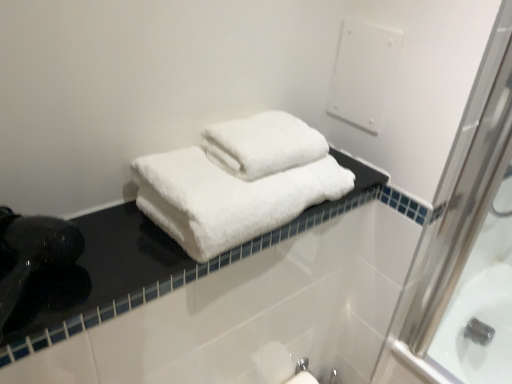
Question: Does white fluffy towels at center come behind black glossy counter top at center?

Choices:
 (A) yes
 (B) no

Answer: (A)

Question: From the image's perspective, would you say white fluffy towels at center is shown under black glossy counter top at center?

Choices:
 (A) no
 (B) yes

Answer: (A)

Question: Would you consider white fluffy towels at center to be distant from black glossy counter top at center?

Choices:
 (A) no
 (B) yes

Answer: (A)

Question: Considering the relative positions of white fluffy towels at center and black glossy counter top at center in the image provided, is white fluffy towels at center in front of black glossy counter top at center?

Choices:
 (A) yes
 (B) no

Answer: (B)

Question: Can you confirm if white fluffy towels at center is wider than black glossy counter top at center?

Choices:
 (A) no
 (B) yes

Answer: (B)

Question: Is white fluffy towels at center oriented towards black glossy counter top at center?

Choices:
 (A) no
 (B) yes

Answer: (A)

Question: From a real-world perspective, is black glossy counter top at center beneath white fluffy towels at center?

Choices:
 (A) yes
 (B) no

Answer: (A)

Question: From a real-world perspective, is black glossy counter top at center on top of white fluffy towels at center?

Choices:
 (A) no
 (B) yes

Answer: (A)

Question: Can you see black glossy counter top at center touching white fluffy towels at center?

Choices:
 (A) yes
 (B) no

Answer: (B)

Question: Is black glossy counter top at center further to camera compared to white fluffy towels at center?

Choices:
 (A) yes
 (B) no

Answer: (B)

Question: Does black glossy counter top at center have a smaller size compared to white fluffy towels at center?

Choices:
 (A) yes
 (B) no

Answer: (A)

Question: From the image's perspective, is black glossy counter top at center over white fluffy towels at center?

Choices:
 (A) no
 (B) yes

Answer: (A)

Question: In the image, is black glossy counter top at center positioned in front of or behind white fluffy towels at center?

Choices:
 (A) behind
 (B) front

Answer: (B)